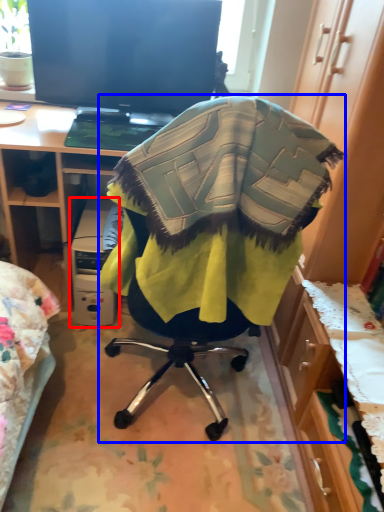
Question: Which object appears farthest to the camera in this image, computer (highlighted by a red box) or chair (highlighted by a blue box)?

Choices:
 (A) computer
 (B) chair

Answer: (A)